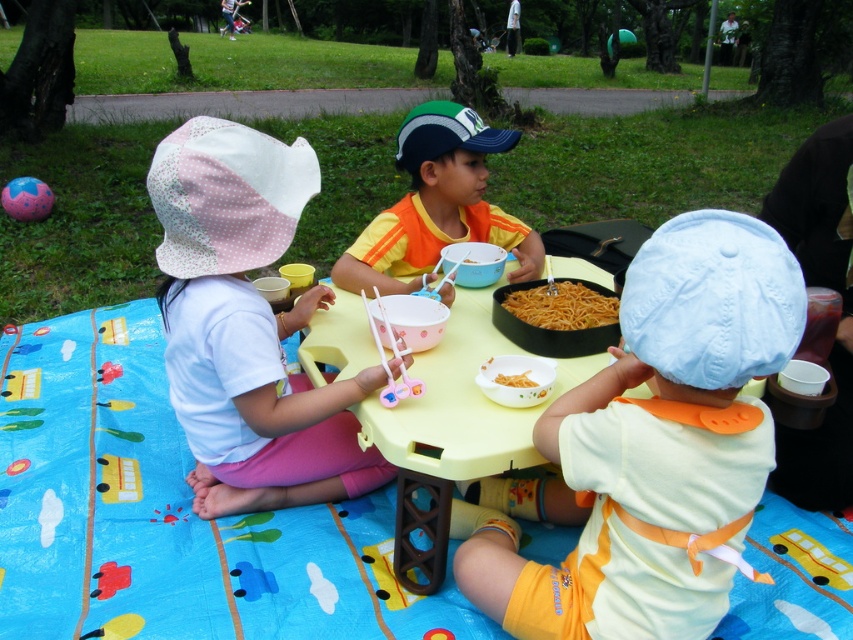
Based on the photo, you are a food critic visiting the picnic and see the two types of noodles, brown matte noodles at center and yellow matte noodles at center. Which one is placed higher on the bowl?

The brown matte noodles at center is located above the yellow matte noodles at center, so it is placed higher in the bowl.

You are a photographer trying to capture the perfect shot of the picnic scene. You notice two points of interest marked as point (537, 326) and point (509, 385). Which point is closer to your camera lens?

Point (537, 326) is further to the viewer than point (509, 385), so the point closer to the camera lens is point (509, 385).